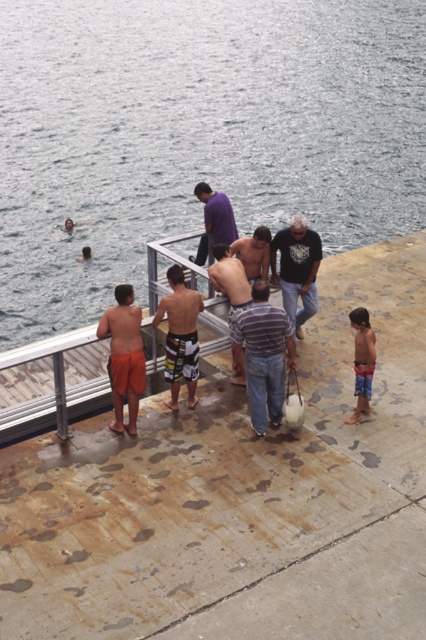
Question: Which object appears farthest from the camera in this image?

Choices:
 (A) striped shirt at center
 (B) blue striped shorts at lower right

Answer: (A)

Question: Is dark gray cotton shirt at center above shiny metallic shirt at center?

Choices:
 (A) yes
 (B) no

Answer: (B)

Question: Does rusty concrete dock at center have a smaller size compared to striped cotton shirt at center?

Choices:
 (A) no
 (B) yes

Answer: (B)

Question: Which of the following is the farthest from the observer?

Choices:
 (A) rusty concrete dock at center
 (B) blue striped shorts at lower right

Answer: (A)

Question: Which of the following is the closest to the observer?

Choices:
 (A) (216, 212)
 (B) (310, 253)
 (C) (198, 307)
 (D) (5, 10)

Answer: (C)

Question: Does clear water at upper left have a larger size compared to striped shirt at center?

Choices:
 (A) yes
 (B) no

Answer: (A)